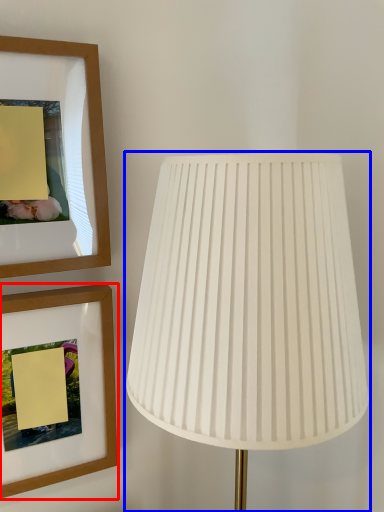
Question: Which object appears closest to the camera in this image, picture frame (highlighted by a red box) or lamp (highlighted by a blue box)?

Choices:
 (A) picture frame
 (B) lamp

Answer: (B)